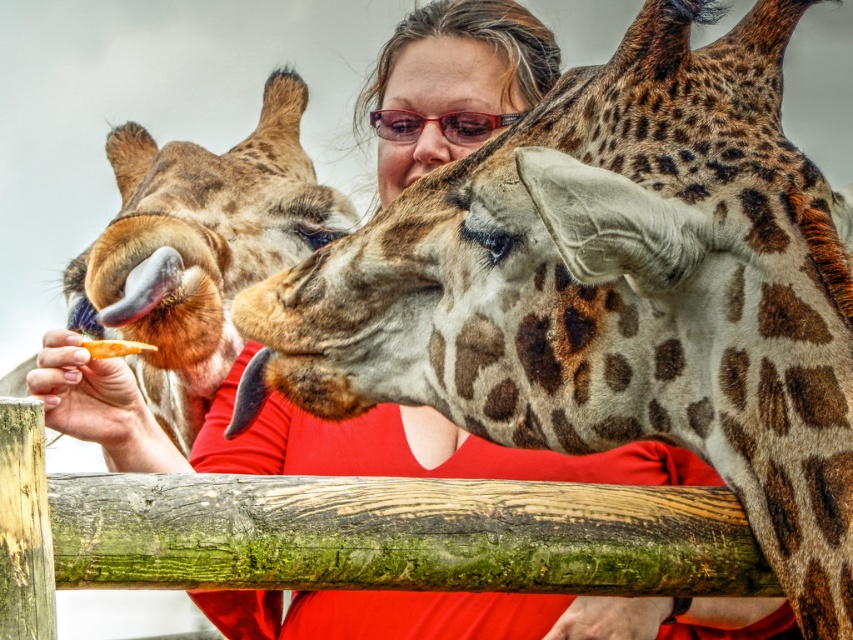
Question: Estimate the real-world distances between objects in this image. Which object is farther from the translucent plastic goggles at center?

Choices:
 (A) green mossy wood at center
 (B) spotted fur giraffe at upper center
 (C) spotted fur giraffe at left

Answer: (A)

Question: Which object is the closest to the green mossy wood at center?

Choices:
 (A) translucent plastic goggles at center
 (B) orange carrot at center

Answer: (B)

Question: Can you confirm if green mossy wood at center is positioned below orange carrot at center?

Choices:
 (A) no
 (B) yes

Answer: (B)

Question: Can you confirm if spotted fur giraffe at upper center is wider than spotted fur giraffe at left?

Choices:
 (A) no
 (B) yes

Answer: (B)

Question: Estimate the real-world distances between objects in this image. Which object is closer to the spotted fur giraffe at upper center?

Choices:
 (A) translucent plastic goggles at center
 (B) green mossy wood at center

Answer: (B)

Question: Can you confirm if spotted fur giraffe at upper center is positioned to the right of orange carrot at center?

Choices:
 (A) yes
 (B) no

Answer: (A)